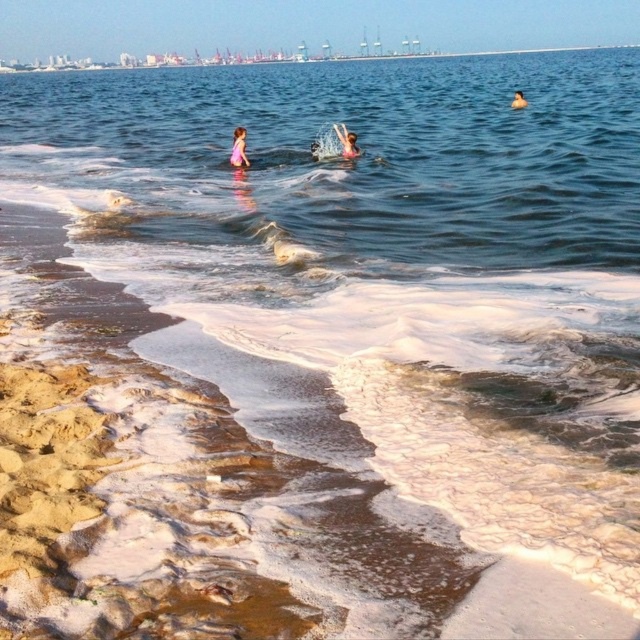
Which is more to the left, pink fabric at upper center or pink fabric at center?

From the viewer's perspective, pink fabric at upper center appears more on the left side.

Locate an element on the screen. This screenshot has height=640, width=640. pink fabric at upper center is located at coordinates (237, 148).

Can you confirm if pink fabric at upper center is positioned to the left of smooth skin person at upper center?

Indeed, pink fabric at upper center is positioned on the left side of smooth skin person at upper center.

The width and height of the screenshot is (640, 640). Identify the location of pink fabric at upper center. (237, 148).

Is pink fabric at center closer to the viewer compared to smooth skin person at upper center?

Yes, pink fabric at center is in front of smooth skin person at upper center.

Where is `pink fabric at center`? The image size is (640, 640). pink fabric at center is located at coordinates (346, 141).